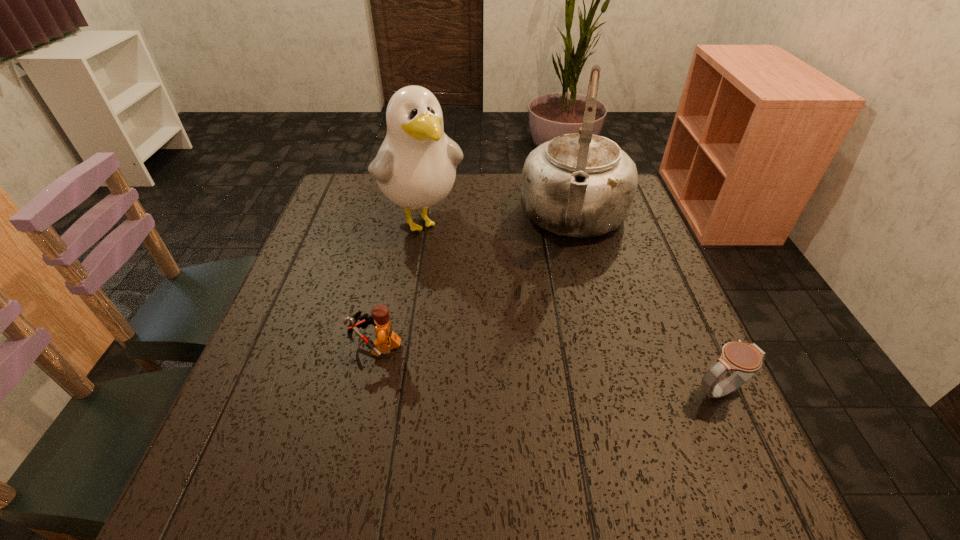
This screenshot has height=540, width=960. What are the coordinates of `vacant space that satisfies the following two spatial constraints: 1. on the front side of the watch; 2. on the right side of the gull` in the screenshot? It's located at 393,390.